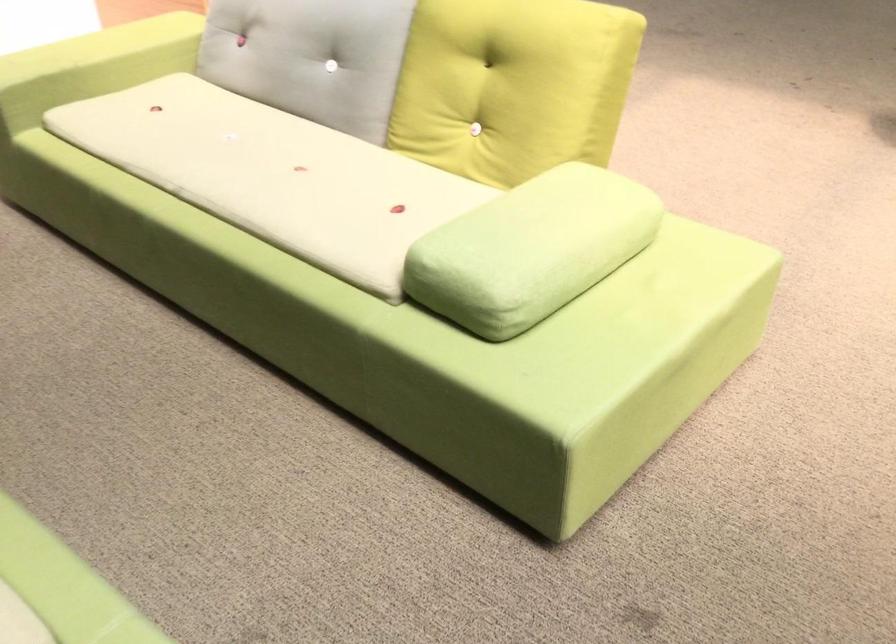
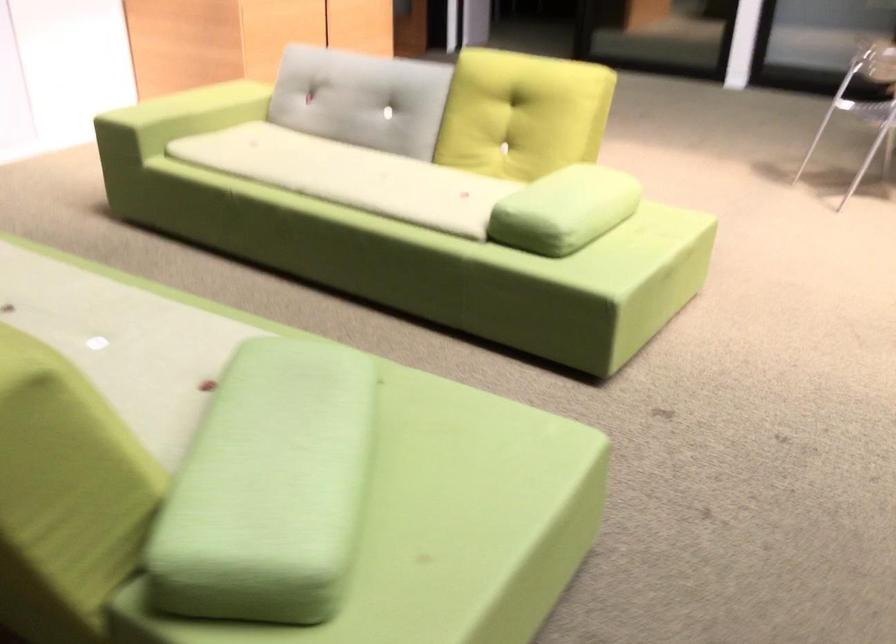
Locate, in the second image, the point that corresponds to [247,176] in the first image.

(349, 176)